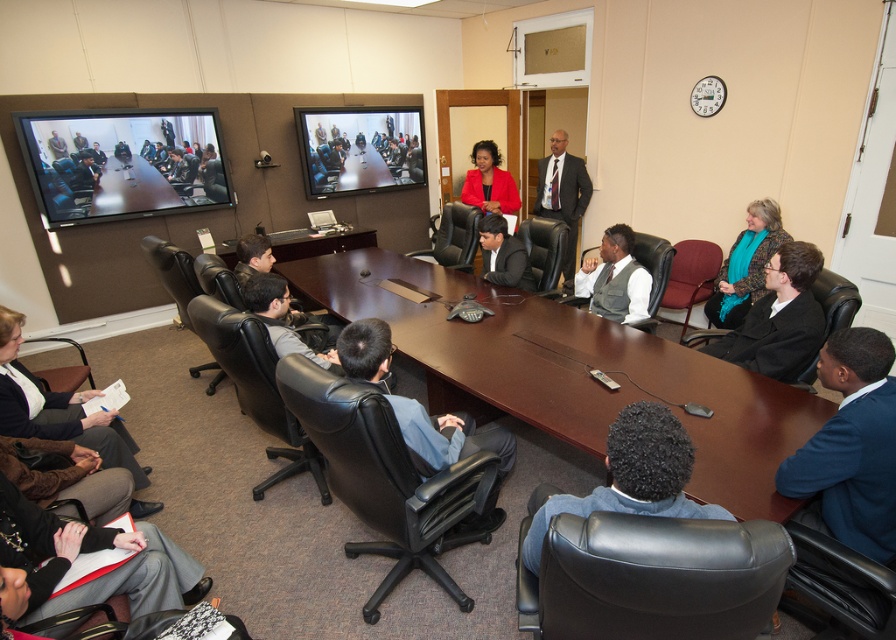
You are a guest attending a formal meeting in the conference room. You notice two people seated at the table wearing the teal knit sweater at right and the dark gray suit at center. Which attendee do you think has a smaller clothing item in terms of size?

The teal knit sweater at right is smaller than the dark gray suit at center, so the attendee wearing the teal knit sweater at right has a smaller clothing item.